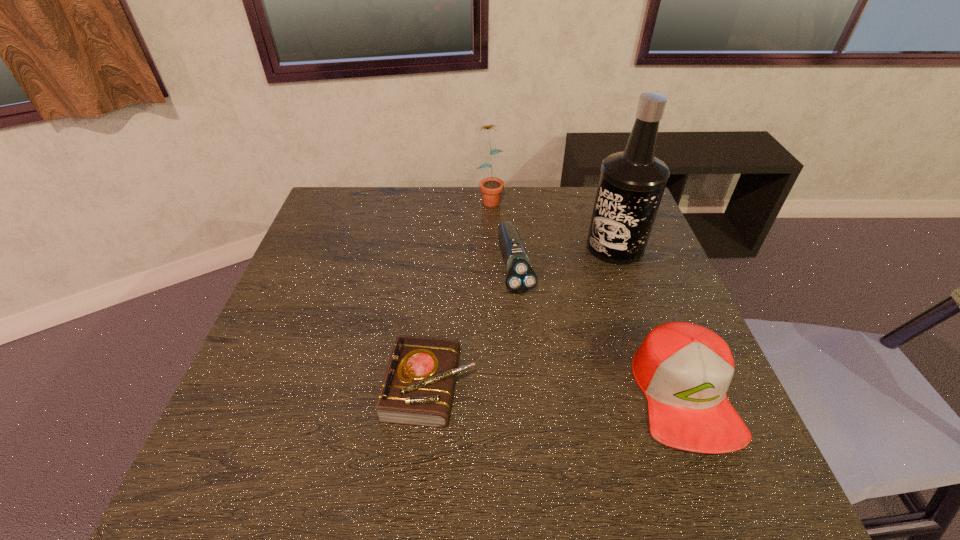
Identify the location of free location located 0.170m on the flower of the farthest object. This screenshot has height=540, width=960. (508, 241).

You are a GUI agent. You are given a task and a screenshot of the screen. Output one action in this format:
    pyautogui.click(x=<x>, y=<y>)
    Task: Click on the vacant space located on the flower of the farthest object
    The width and height of the screenshot is (960, 540).
    Given the screenshot: What is the action you would take?
    pyautogui.click(x=530, y=291)

Find the location of a particular element. free space located 0.370m on the flower of the farthest object is located at coordinates (529, 288).

The height and width of the screenshot is (540, 960). I want to click on free space located 0.210m on the head of the fourth tallest object, so 541,367.

Locate an element on the screen. This screenshot has height=540, width=960. vacant space located 0.210m on the head of the fourth tallest object is located at coordinates (541, 367).

Where is `free space located 0.340m on the head of the fourth tallest object`? free space located 0.340m on the head of the fourth tallest object is located at coordinates (558, 422).

Identify the location of liquor situated at the far edge. The image size is (960, 540). (631, 185).

Find the location of `sunflower present at the far edge`. sunflower present at the far edge is located at coordinates (491, 187).

At what (x,y) coordinates should I click in order to perform the action: click on diary that is at the near edge. Please return your answer as a coordinate pair (x, y). The width and height of the screenshot is (960, 540). Looking at the image, I should click on (417, 389).

Where is `baseball cap that is at the near edge`? Image resolution: width=960 pixels, height=540 pixels. baseball cap that is at the near edge is located at coordinates (684, 370).